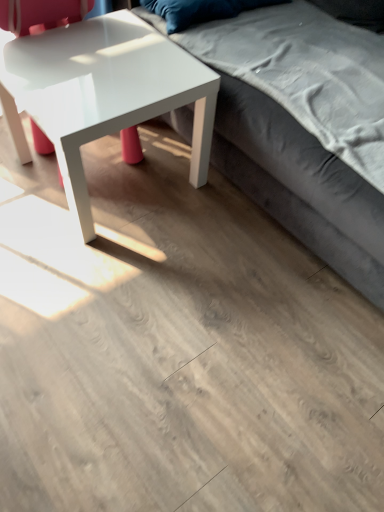
What do you see at coordinates (296, 145) in the screenshot?
I see `velvet gray couch at upper right` at bounding box center [296, 145].

Locate an element on the screen. glossy white coffee table at left is located at coordinates (103, 93).

Considering the points (180, 101) and (187, 120), which point is behind, point (180, 101) or point (187, 120)?

Positioned behind is point (187, 120).

Is glossy white coffee table at left facing away from velvet gray couch at upper right?

No, glossy white coffee table at left is not facing the opposite direction of velvet gray couch at upper right.

Can you confirm if glossy white coffee table at left is thinner than velvet gray couch at upper right?

Correct, the width of glossy white coffee table at left is less than that of velvet gray couch at upper right.

Does glossy white coffee table at left touch velvet gray couch at upper right?

glossy white coffee table at left and velvet gray couch at upper right are not in contact.

Does point (325, 234) come farther from viewer compared to point (50, 112)?

Yes, point (325, 234) is behind point (50, 112).

In terms of height, does velvet gray couch at upper right look taller or shorter compared to glossy white coffee table at left?

Clearly, velvet gray couch at upper right is taller compared to glossy white coffee table at left.

Is velvet gray couch at upper right to the left of glossy white coffee table at left from the viewer's perspective?

In fact, velvet gray couch at upper right is to the right of glossy white coffee table at left.

Is velvet blue pillow at upper center aimed at glossy white coffee table at left?

No, velvet blue pillow at upper center is not facing towards glossy white coffee table at left.

Would you say velvet blue pillow at upper center is to the left or to the right of glossy white coffee table at left in the picture?

velvet blue pillow at upper center is positioned on glossy white coffee table at left's right side.

Is velvet blue pillow at upper center positioned beyond the bounds of glossy white coffee table at left?

Yes, velvet blue pillow at upper center is outside of glossy white coffee table at left.

Considering the sizes of objects velvet blue pillow at upper center and glossy white coffee table at left in the image provided, who is bigger, velvet blue pillow at upper center or glossy white coffee table at left?

glossy white coffee table at left.

Is glossy white coffee table at left closer to camera compared to velvet blue pillow at upper center?

Yes.

Can you confirm if glossy white coffee table at left is positioned to the right of velvet blue pillow at upper center?

No, glossy white coffee table at left is not to the right of velvet blue pillow at upper center.

Is glossy white coffee table at left aimed at velvet blue pillow at upper center?

No, glossy white coffee table at left is not aimed at velvet blue pillow at upper center.

Which object is closer to the camera, velvet gray couch at upper right or velvet blue pillow at upper center?

velvet gray couch at upper right is in front.

How much distance is there between velvet gray couch at upper right and velvet blue pillow at upper center?

A distance of 42.95 centimeters exists between velvet gray couch at upper right and velvet blue pillow at upper center.

Based on the photo, what's the angular difference between velvet gray couch at upper right and velvet blue pillow at upper center's facing directions?

The angular difference between velvet gray couch at upper right and velvet blue pillow at upper center is 89.3 degrees.

Is velvet gray couch at upper right inside or outside of velvet blue pillow at upper center?

velvet gray couch at upper right is spatially situated outside velvet blue pillow at upper center.

Can you confirm if velvet blue pillow at upper center is wider than velvet gray couch at upper right?

Incorrect, the width of velvet blue pillow at upper center does not surpass that of velvet gray couch at upper right.

Which is more to the left, velvet blue pillow at upper center or velvet gray couch at upper right?

From the viewer's perspective, velvet blue pillow at upper center appears more on the left side.

From the image's perspective, does velvet blue pillow at upper center appear lower than velvet gray couch at upper right?

No, from the image's perspective, velvet blue pillow at upper center is not below velvet gray couch at upper right.

This screenshot has height=512, width=384. What are the coordinates of `pillow that is behind the velvet gray couch at upper right` in the screenshot? It's located at (191, 11).

Where is `coffee table located below the velvet gray couch at upper right (from the image's perspective)`? This screenshot has height=512, width=384. coffee table located below the velvet gray couch at upper right (from the image's perspective) is located at coordinates (103, 93).

Image resolution: width=384 pixels, height=512 pixels. Identify the location of studio couch above the glossy white coffee table at left (from a real-world perspective). (296, 145).

Looking at the image, which one is located closer to glossy white coffee table at left, velvet blue pillow at upper center or velvet gray couch at upper right?

Among the two, velvet gray couch at upper right is located nearer to glossy white coffee table at left.

Looking at the image, which one is located further to glossy white coffee table at left, velvet gray couch at upper right or velvet blue pillow at upper center?

velvet blue pillow at upper center.

Considering their positions, is glossy white coffee table at left positioned closer to velvet blue pillow at upper center than velvet gray couch at upper right?

glossy white coffee table at left is positioned closer to the anchor velvet blue pillow at upper center.

Which object lies further to the anchor point velvet gray couch at upper right, velvet blue pillow at upper center or glossy white coffee table at left?

The object further to velvet gray couch at upper right is velvet blue pillow at upper center.

Which object lies nearer to the anchor point velvet gray couch at upper right, glossy white coffee table at left or velvet blue pillow at upper center?

The object closer to velvet gray couch at upper right is glossy white coffee table at left.

From the image, which object appears to be nearer to velvet blue pillow at upper center, velvet gray couch at upper right or glossy white coffee table at left?

glossy white coffee table at left.

I want to click on pillow located between glossy white coffee table at left and velvet gray couch at upper right in the left-right direction, so click(191, 11).